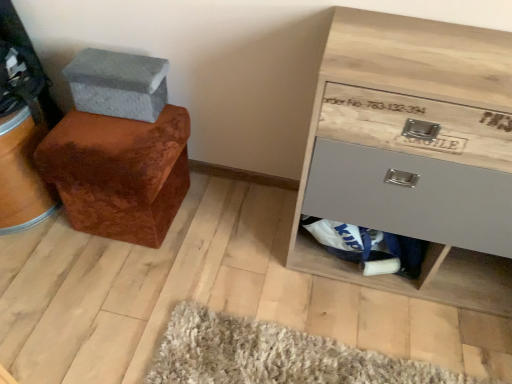
Find the location of `unoccupied area in front of velvet brown ottoman at left`. unoccupied area in front of velvet brown ottoman at left is located at coordinates (101, 285).